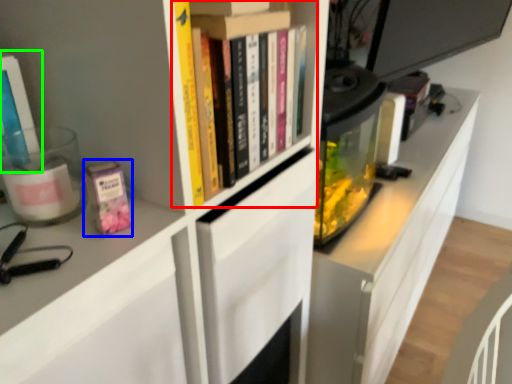
Question: Which is farther away from book (highlighted by a red box)? paperback book (highlighted by a blue box) or book (highlighted by a green box)?

Choices:
 (A) paperback book
 (B) book

Answer: (B)